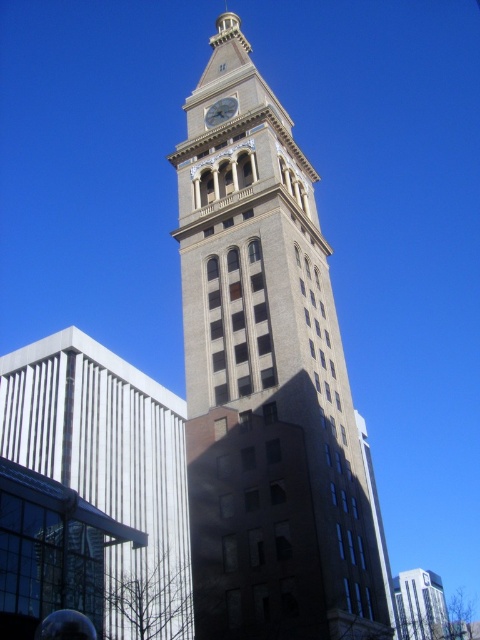
Question: Where is beige stone clock tower at center located in relation to gold metallic clock at center in the image?

Choices:
 (A) right
 (B) left

Answer: (A)

Question: Which point appears farthest from the camera in this image?

Choices:
 (A) (265, 602)
 (B) (218, 115)

Answer: (B)

Question: Among these objects, which one is farthest from the camera?

Choices:
 (A) beige stone clock tower at center
 (B) gold metallic clock at center

Answer: (B)

Question: Can you confirm if beige stone clock tower at center is wider than gold metallic clock at center?

Choices:
 (A) yes
 (B) no

Answer: (A)

Question: Is beige stone clock tower at center above gold metallic clock at center?

Choices:
 (A) no
 (B) yes

Answer: (A)

Question: Which object is farther from the camera taking this photo?

Choices:
 (A) beige stone clock tower at center
 (B) gold metallic clock at center

Answer: (B)